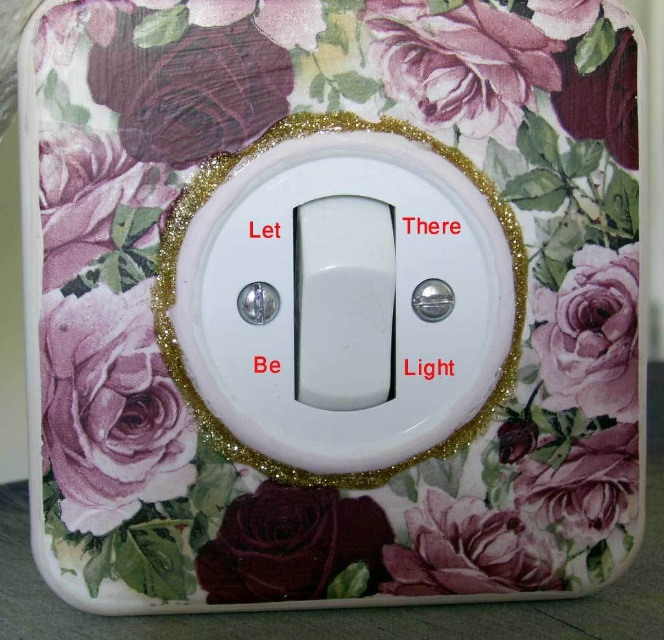
Which is in front, point (373, 122) or point (566, 387)?

Point (373, 122) is more forward.

Is white plastic light switch at center bigger than pink glossy rose at upper right?

Correct, white plastic light switch at center is larger in size than pink glossy rose at upper right.

Does point (207, 410) come behind point (590, 371)?

No, (207, 410) is in front of (590, 371).

Identify the location of white plastic light switch at center. (175, 282).

Who is taller, matte purple fabric rose at upper left or matte burgundy rose at lower center?

matte purple fabric rose at upper left

Is point (236, 124) less distant than point (295, 518)?

Yes, it is.

Who is more forward, [141,96] or [305,563]?

Point [141,96]

I want to click on matte purple fabric rose at upper left, so click(191, 88).

Between matte burgundy rose at lower center and pink glossy rose at upper right, which one is positioned lower?

matte burgundy rose at lower center is lower down.

Locate an element on the screen. Image resolution: width=664 pixels, height=640 pixels. matte burgundy rose at lower center is located at coordinates (290, 545).